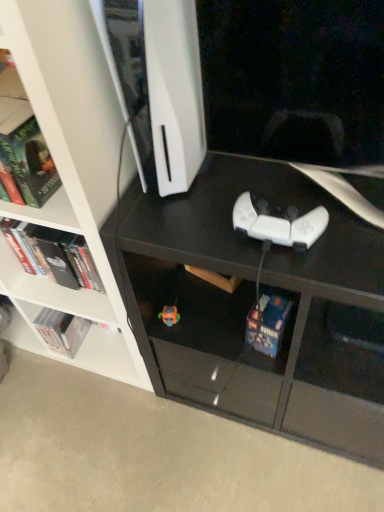
Where is `empty space that is to the right of white matte game controller at center`? This screenshot has height=512, width=384. empty space that is to the right of white matte game controller at center is located at coordinates (350, 219).